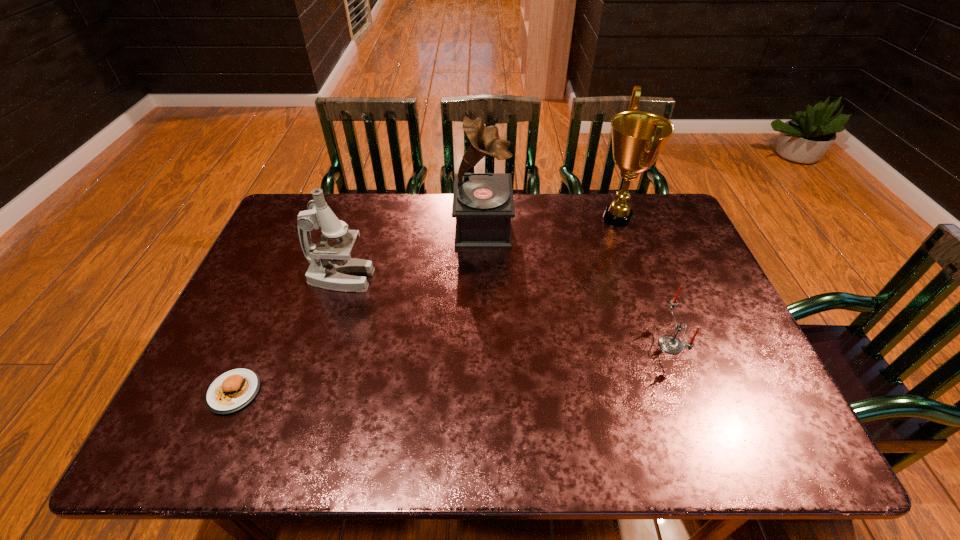
I want to click on award, so click(638, 137).

The image size is (960, 540). What are the coordinates of `phonograph_record` in the screenshot? It's located at (483, 205).

The width and height of the screenshot is (960, 540). Find the location of `the fourth object from right to left`. the fourth object from right to left is located at coordinates (332, 267).

Image resolution: width=960 pixels, height=540 pixels. Identify the location of the third farthest object. [x=332, y=267].

Find the location of a particular element. The width and height of the screenshot is (960, 540). candle is located at coordinates (670, 344).

The height and width of the screenshot is (540, 960). I want to click on the fourth farthest object, so click(670, 344).

Identify the location of the leftmost object. (235, 389).

The height and width of the screenshot is (540, 960). I want to click on the shortest object, so click(235, 389).

The image size is (960, 540). I want to click on vacant space located 0.320m on the front view with handles of the award, so click(494, 218).

This screenshot has width=960, height=540. I want to click on vacant space situated 0.320m on the front view with handles of the award, so click(x=494, y=218).